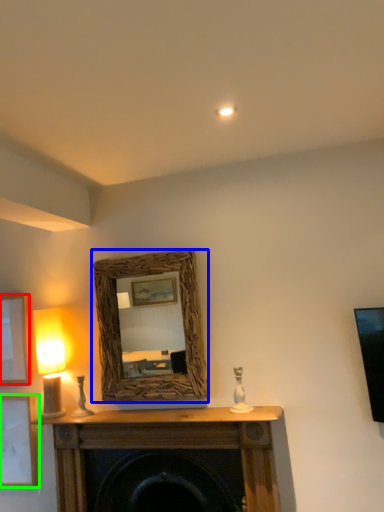
Question: Which object is the farthest from picture frame (highlighted by a red box)? Choose among these: mirror (highlighted by a blue box) or picture frame (highlighted by a green box).

Choices:
 (A) mirror
 (B) picture frame

Answer: (A)